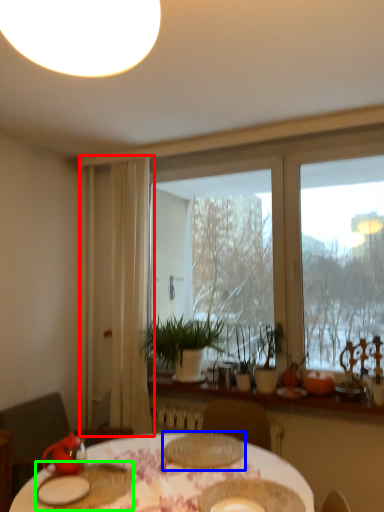
Question: Which object is the closest to the curtain (highlighted by a red box)? Choose among these: tableware (highlighted by a blue box) or tableware (highlighted by a green box).

Choices:
 (A) tableware
 (B) tableware

Answer: (A)